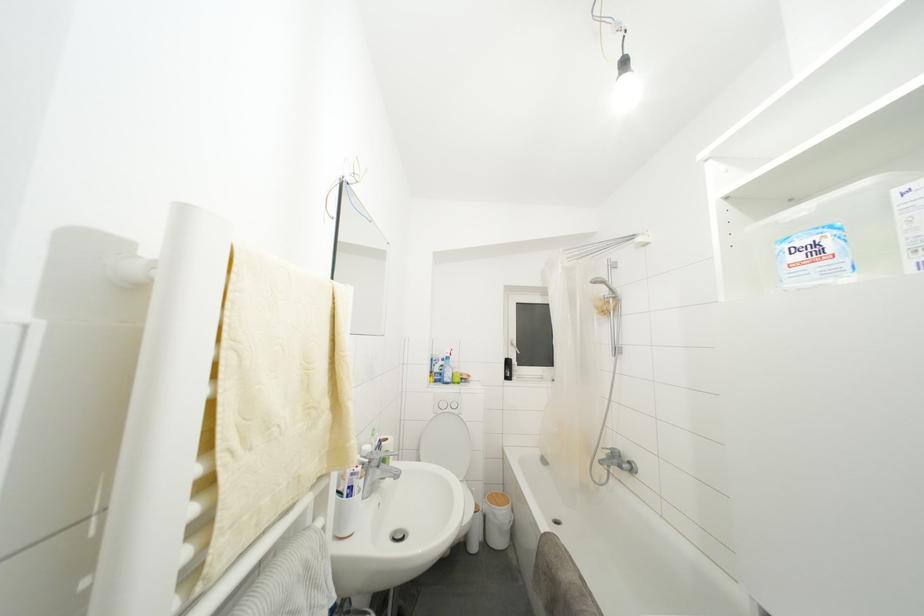
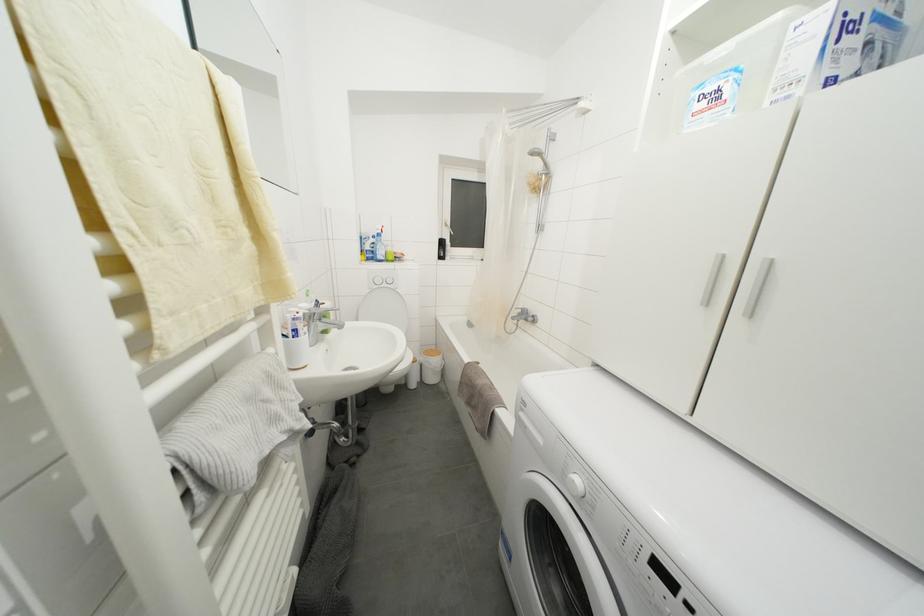
The first image is from the beginning of the video and the second image is from the end. How did the camera likely rotate when shooting the video?

The rotation direction of the camera is right-down.